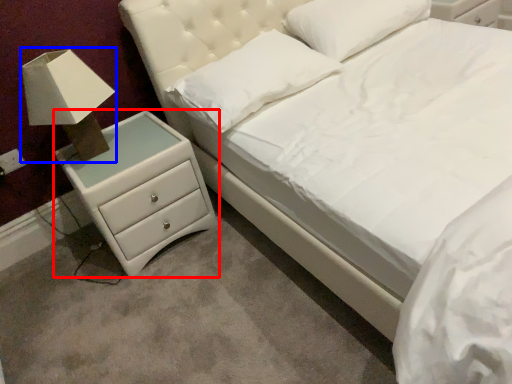
Question: Which point is closer to the camera, chest of drawers (highlighted by a red box) or table lamp (highlighted by a blue box)?

Choices:
 (A) chest of drawers
 (B) table lamp

Answer: (B)